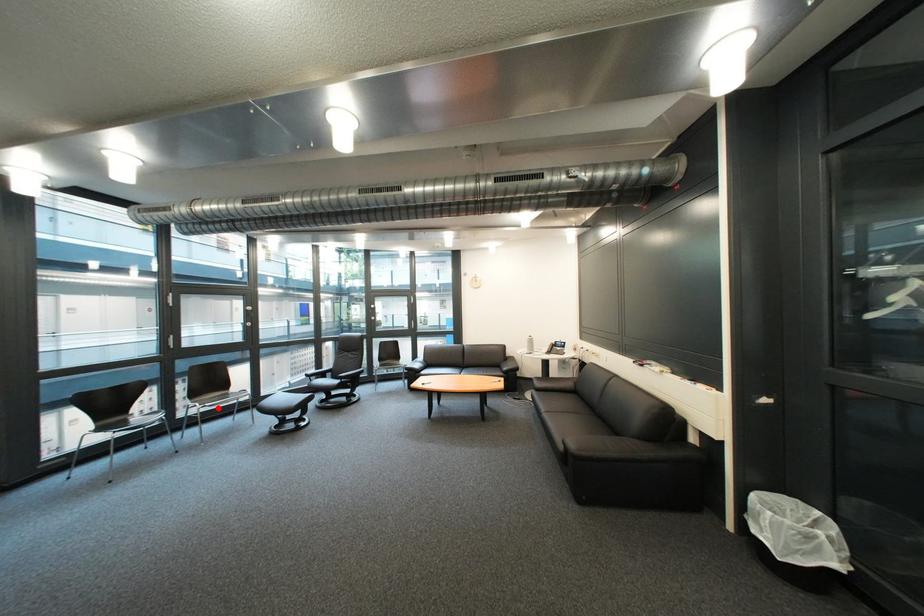
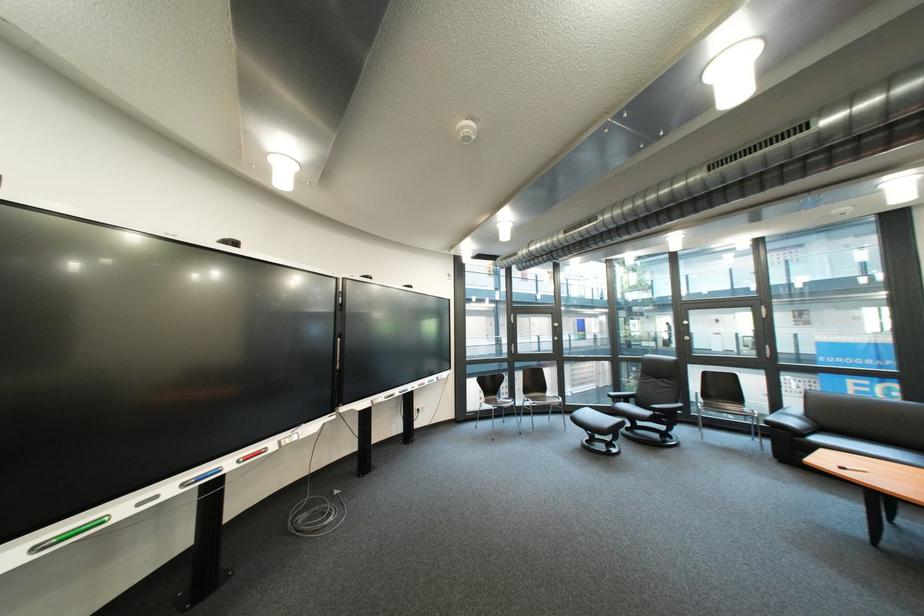
Question: A red point is marked in image1. In image2, is the corresponding 3D point closer to the camera or farther? Reply with the corresponding letter.

Choices:
 (A) The corresponding 3D point is closer.
 (B) The corresponding 3D point is farther.

Answer: (B)